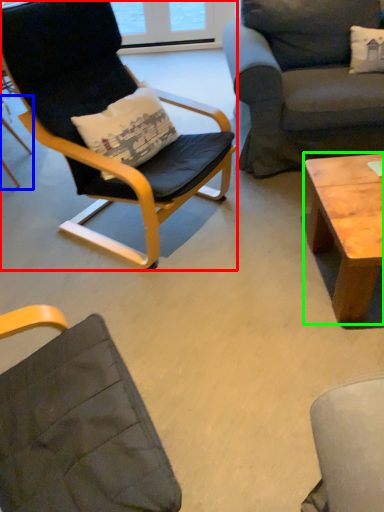
Question: Considering the real-world distances, which object is farthest from chair (highlighted by a red box)? chair (highlighted by a blue box) or coffee table (highlighted by a green box)?

Choices:
 (A) chair
 (B) coffee table

Answer: (A)